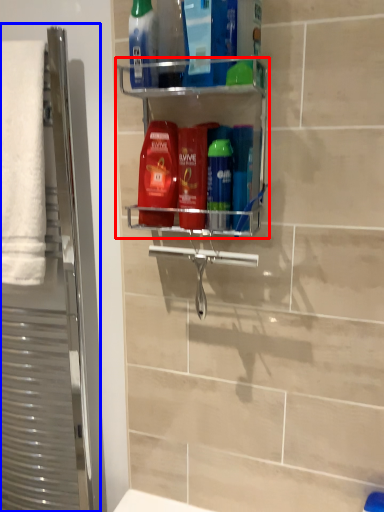
Question: Among these objects, which one is nearest to the camera, shelf (highlighted by a red box) or screen door (highlighted by a blue box)?

Choices:
 (A) shelf
 (B) screen door

Answer: (A)